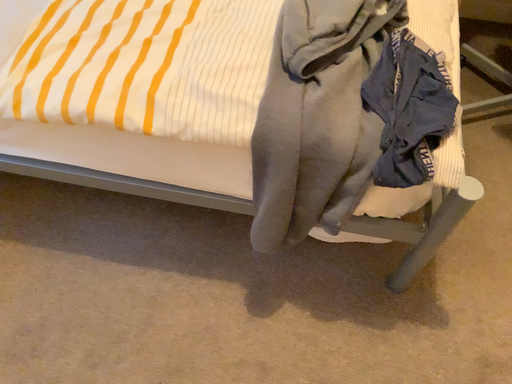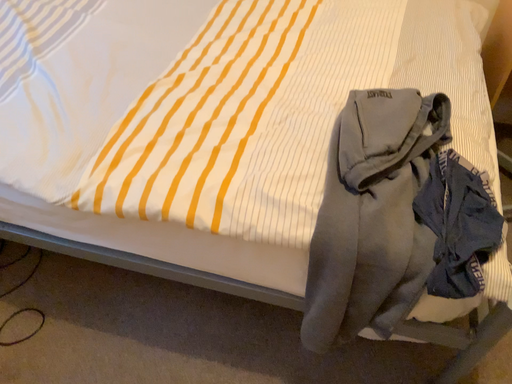
Question: How did the camera likely rotate when shooting the video?

Choices:
 (A) rotated upward
 (B) rotated downward

Answer: (A)